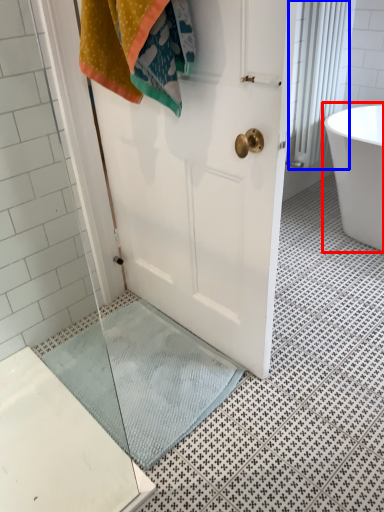
Question: Which of the following is the closest to the observer, bathtub (highlighted by a red box) or shower curtain (highlighted by a blue box)?

Choices:
 (A) bathtub
 (B) shower curtain

Answer: (A)